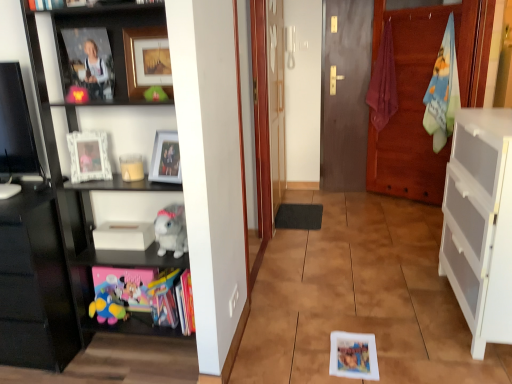
The height and width of the screenshot is (384, 512). Find the location of `vacant region to the left of white matte cabinet at right, acting as the 1th cabinetry starting from the right`. vacant region to the left of white matte cabinet at right, acting as the 1th cabinetry starting from the right is located at coordinates (383, 289).